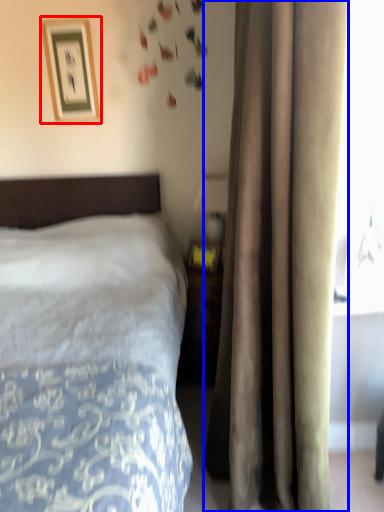
Question: Among these objects, which one is nearest to the camera, picture frame (highlighted by a red box) or curtain (highlighted by a blue box)?

Choices:
 (A) picture frame
 (B) curtain

Answer: (B)